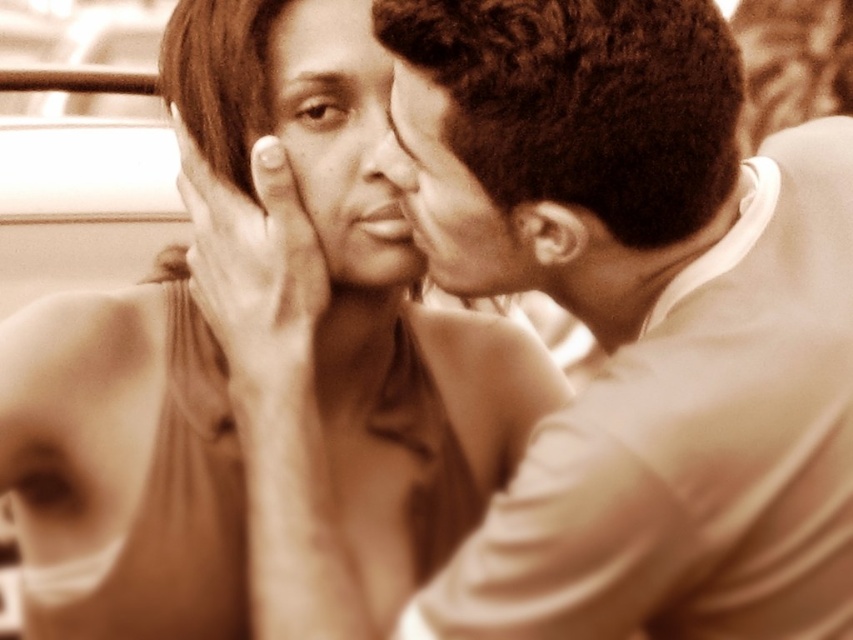
You are a photographer analyzing the composition of this image. You notice two points of interest labeled as point (527,282) and point (456,216). Which point is closer to the camera?

Point (527,282) is closer to the camera than point (456,216).

You are an interior designer analyzing the placement of furniture in a room. The room has a sofa placed at the center. You need to place a new decorative item exactly at the coordinates given for the smooth beige dress at center. What are the coordinates where you should place the new item?

The coordinates for the smooth beige dress at center are at point (364, 305), so you should place the new item there.

In the scene shown: You are a photographer trying to capture a closeup shot of the smooth skin nose at center without including the smooth beige dress at center in the frame. Is this possible given their sizes?

The smooth beige dress at center is bigger than the smooth skin nose at center, so it might be challenging to frame the nose without including the dress due to the dress being larger in size.